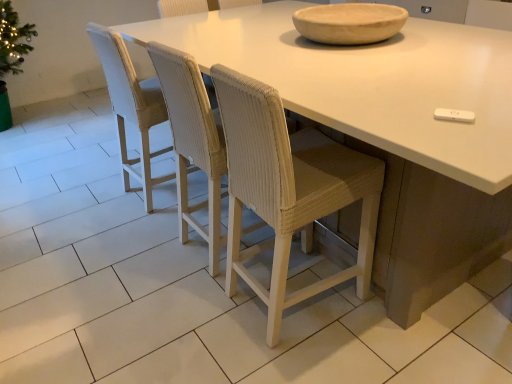
Locate an element on the screen. white matte table at center is located at coordinates (389, 130).

What is the approximate height of woven white chair at left, which is the 1th chair in left-to-right order?

woven white chair at left, which is the 1th chair in left-to-right order, is 1.00 meters in height.

This screenshot has height=384, width=512. In order to click on white matte table at center in this screenshot , I will do `click(389, 130)`.

Can you confirm if natural wood bowl at upper center is bigger than woven white chair at center, which is the 2th chair in left-to-right order?

Actually, natural wood bowl at upper center might be smaller than woven white chair at center, which is the 2th chair in left-to-right order.

Where is `bowl above the woven white chair at center, which is the 2th chair in left-to-right order (from a real-world perspective)`? The image size is (512, 384). bowl above the woven white chair at center, which is the 2th chair in left-to-right order (from a real-world perspective) is located at coordinates (350, 23).

Which is less distant, (382,33) or (162,74)?

Point (382,33) appears to be farther away from the viewer than point (162,74).

Which of these two, natural wood bowl at upper center or woven white chair at left, the fourth chair from the right, is smaller?

With smaller size is natural wood bowl at upper center.

Is natural wood bowl at upper center positioned with its back to woven white chair at left, which is the 1th chair in left-to-right order?

No, natural wood bowl at upper center's orientation is not away from woven white chair at left, which is the 1th chair in left-to-right order.

Considering the relative sizes of natural wood bowl at upper center and woven white chair at left, the fourth chair from the right, in the image provided, is natural wood bowl at upper center taller than woven white chair at left, the fourth chair from the right,?

In fact, natural wood bowl at upper center may be shorter than woven white chair at left, the fourth chair from the right.

Does natural wood bowl at upper center have a greater width compared to woven white chair at left, the fourth chair from the right?

Correct, the width of natural wood bowl at upper center exceeds that of woven white chair at left, the fourth chair from the right.

Considering the positions of points (203, 44) and (148, 182), is point (203, 44) farther from camera compared to point (148, 182)?

That is False.

Considering their positions, is white matte table at center located in front of or behind woven white chair at left, the fourth chair from the right?

Clearly, white matte table at center is in front of woven white chair at left, the fourth chair from the right.

Could you tell me if white matte table at center is facing woven white chair at left, the fourth chair from the right?

Yes, white matte table at center is aimed at woven white chair at left, the fourth chair from the right.

Is white matte table at center taller than woven white chair at center, which is the 2th chair in left-to-right order?

In fact, white matte table at center may be shorter than woven white chair at center, which is the 2th chair in left-to-right order.

Is white matte table at center outside of woven white chair at center, the third chair from the right?

Absolutely, white matte table at center is external to woven white chair at center, the third chair from the right.

Is white matte table at center surrounding woven white chair at center, marked as the second chair in a right-to-left arrangement?

Yes, white matte table at center is surrounding woven white chair at center, marked as the second chair in a right-to-left arrangement.

Visually, is white matte table at center positioned to the left or to the right of woven white chair at center, which ranks as the third chair in left-to-right order?

Clearly, white matte table at center is on the right of woven white chair at center, which ranks as the third chair in left-to-right order, in the image.

Does point (310, 71) appear closer or farther from the camera than point (298, 149)?

Clearly, point (310, 71) is closer to the camera than point (298, 149).

Would you say white matte table at center is a long distance from woven white chair at center, which ranks as the third chair in left-to-right order?

No, white matte table at center is not far away from woven white chair at center, which ranks as the third chair in left-to-right order.

Does white woven chair at center, the fourth chair from the left, have a lesser height compared to woven white chair at center, which is the 2th chair in left-to-right order?

Correct, white woven chair at center, the fourth chair from the left, is not as tall as woven white chair at center, which is the 2th chair in left-to-right order.

Is white woven chair at center, the fourth chair from the left, placed right next to woven white chair at center, the third chair from the right?

No, white woven chair at center, the fourth chair from the left, is not next to woven white chair at center, the third chair from the right.

Could you measure the distance between white woven chair at center, which appears as the 1th chair when viewed from the right, and woven white chair at center, the third chair from the right?

7.91 feet.

Based on the photo, considering the sizes of objects white woven chair at center, which appears as the 1th chair when viewed from the right, and woven white chair at center, the third chair from the right, in the image provided, who is smaller, white woven chair at center, which appears as the 1th chair when viewed from the right, or woven white chair at center, the third chair from the right,?

white woven chair at center, which appears as the 1th chair when viewed from the right, is smaller.

Is woven white chair at center, the third chair from the right, smaller than white matte table at center?

Indeed, woven white chair at center, the third chair from the right, has a smaller size compared to white matte table at center.

From a real-world perspective, which is physically above, woven white chair at center, the third chair from the right, or white matte table at center?

From a 3D spatial view, woven white chair at center, the third chair from the right, is above.

Is the position of woven white chair at center, which is the 2th chair in left-to-right order, more distant than that of white matte table at center?

Yes, woven white chair at center, which is the 2th chair in left-to-right order, is further from the viewer.

From the image's perspective, is woven white chair at center, which is the 2th chair in left-to-right order, located beneath white matte table at center?

Yes, from the image's perspective, woven white chair at center, which is the 2th chair in left-to-right order, is below white matte table at center.

The image size is (512, 384). I want to click on chair that is the 2nd one when counting downward from the natural wood bowl at upper center (from the image's perspective), so click(193, 142).

This screenshot has width=512, height=384. What are the coordinates of `the 3rd chair counting from the left of the natural wood bowl at upper center` in the screenshot? It's located at (131, 107).

Which object lies further to the anchor point white matte table at center, white woven chair at center, which appears as the 1th chair when viewed from the right, or woven white chair at left, which is the 1th chair in left-to-right order?

white woven chair at center, which appears as the 1th chair when viewed from the right, is positioned further to the anchor white matte table at center.

Looking at the image, which one is located closer to white matte table at center, woven white chair at left, which is the 1th chair in left-to-right order, or white woven chair at center, which appears as the 1th chair when viewed from the right?

The object closer to white matte table at center is woven white chair at left, which is the 1th chair in left-to-right order.

From the image, which object appears to be farther from woven white chair at left, which is the 1th chair in left-to-right order, woven white chair at center, marked as the second chair in a right-to-left arrangement, or woven white chair at center, the third chair from the right?

woven white chair at center, marked as the second chair in a right-to-left arrangement, is further to woven white chair at left, which is the 1th chair in left-to-right order.

Looking at the image, which one is located further to woven white chair at center, the third chair from the right, woven white chair at center, which ranks as the third chair in left-to-right order, or white woven chair at center, which appears as the 1th chair when viewed from the right?

white woven chair at center, which appears as the 1th chair when viewed from the right, is further to woven white chair at center, the third chair from the right.

Looking at this image, which object lies further to the anchor point white matte table at center, woven white chair at center, which ranks as the third chair in left-to-right order, or natural wood bowl at upper center?

natural wood bowl at upper center lies further to white matte table at center than the other object.

Based on their spatial positions, is white woven chair at center, the fourth chair from the left, or white matte table at center further from natural wood bowl at upper center?

white woven chair at center, the fourth chair from the left, is further to natural wood bowl at upper center.

Consider the image. Considering their positions, is white woven chair at center, which appears as the 1th chair when viewed from the right, positioned closer to woven white chair at center, which ranks as the third chair in left-to-right order, than woven white chair at left, which is the 1th chair in left-to-right order?

woven white chair at left, which is the 1th chair in left-to-right order, lies closer to woven white chair at center, which ranks as the third chair in left-to-right order, than the other object.

Based on their spatial positions, is woven white chair at center, which ranks as the third chair in left-to-right order, or woven white chair at center, the third chair from the right, further from white matte table at center?

Based on the image, woven white chair at center, the third chair from the right, appears to be further to white matte table at center.

Locate an element on the screen. bowl between white matte table at center and woven white chair at left, the fourth chair from the right, along the z-axis is located at coordinates (350, 23).

You are a GUI agent. You are given a task and a screenshot of the screen. Output one action in this format:
    pyautogui.click(x=<x>, y=<y>)
    Task: Click on the chair between woven white chair at center, the third chair from the right, and white woven chair at center, which appears as the 1th chair when viewed from the right, in the horizontal direction
    This screenshot has width=512, height=384.
    Given the screenshot: What is the action you would take?
    pyautogui.click(x=289, y=189)

Where is `bowl located between white matte table at center and white woven chair at center, the fourth chair from the left, in the depth direction`? bowl located between white matte table at center and white woven chair at center, the fourth chair from the left, in the depth direction is located at coordinates (350, 23).

Where is `bowl situated between woven white chair at center, which ranks as the third chair in left-to-right order, and white woven chair at center, the fourth chair from the left, from left to right`? bowl situated between woven white chair at center, which ranks as the third chair in left-to-right order, and white woven chair at center, the fourth chair from the left, from left to right is located at coordinates (350, 23).